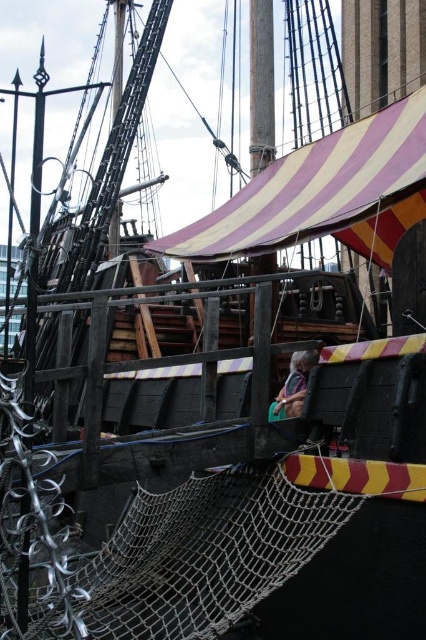
Which is above, striped canvas canopy at upper center or green fabric bag at center?

striped canvas canopy at upper center

Which is behind, point (342, 148) or point (287, 388)?

Point (342, 148)

Where is `striped canvas canopy at upper center`? This screenshot has width=426, height=640. striped canvas canopy at upper center is located at coordinates (313, 186).